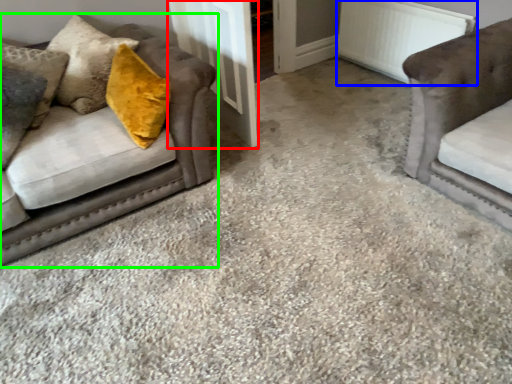
Question: Which is nearer to the door (highlighted by a red box)? radiator (highlighted by a blue box) or studio couch (highlighted by a green box).

Choices:
 (A) radiator
 (B) studio couch

Answer: (B)